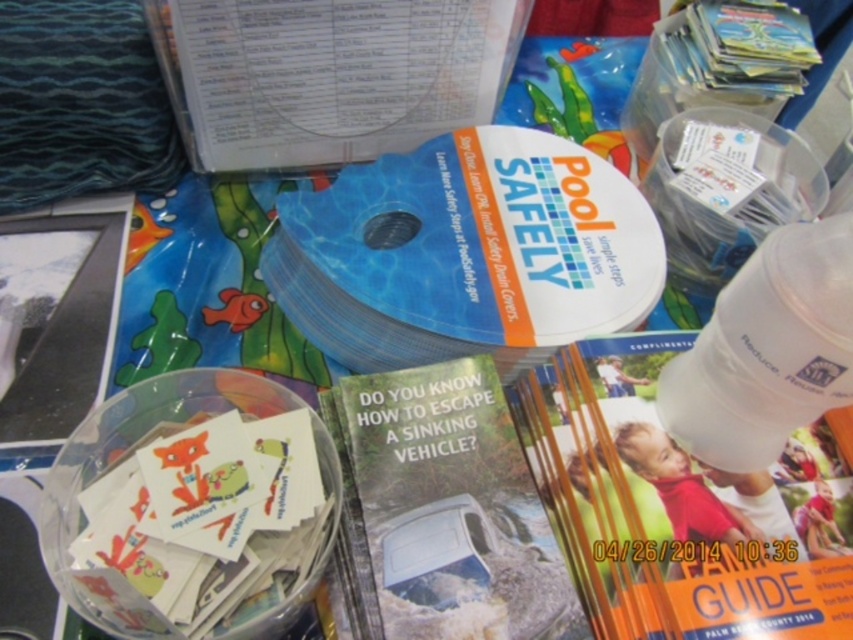
Is point (554, 426) positioned in front of point (350, 116)?

That is True.

Who is shorter, matte paper guide at center or white glossy magazine at upper center?

white glossy magazine at upper center

Is point (584, 592) closer to viewer compared to point (364, 97)?

That is True.

At what (x,y) coordinates should I click in order to perform the action: click on matte paper guide at center. Please return your answer as a coordinate pair (x, y). Looking at the image, I should click on (682, 506).

Does green glossy brochure at center have a smaller size compared to white translucent bottle at center-right?

Yes, green glossy brochure at center is smaller than white translucent bottle at center-right.

Between point (532, 524) and point (782, 394), which one is positioned in front?

Point (782, 394) is more forward.

Image resolution: width=853 pixels, height=640 pixels. I want to click on green glossy brochure at center, so click(x=445, y=509).

Describe the element at coordinates (328, 74) in the screenshot. I see `white glossy magazine at upper center` at that location.

At what (x,y) coordinates should I click in order to perform the action: click on white glossy magazine at upper center. Please return your answer as a coordinate pair (x, y). The image size is (853, 640). Looking at the image, I should click on (328, 74).